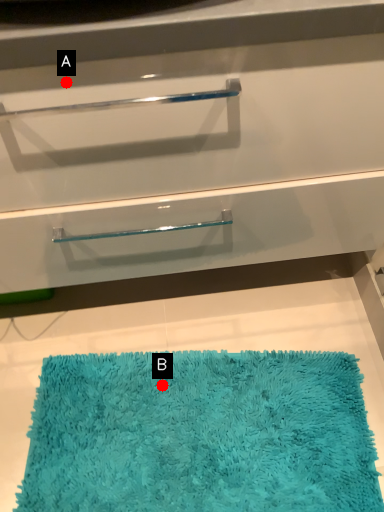
Question: Two points are circled on the image, labeled by A and B beside each circle. Among these points, which one is farthest from the camera?

Choices:
 (A) A is further
 (B) B is further

Answer: (B)